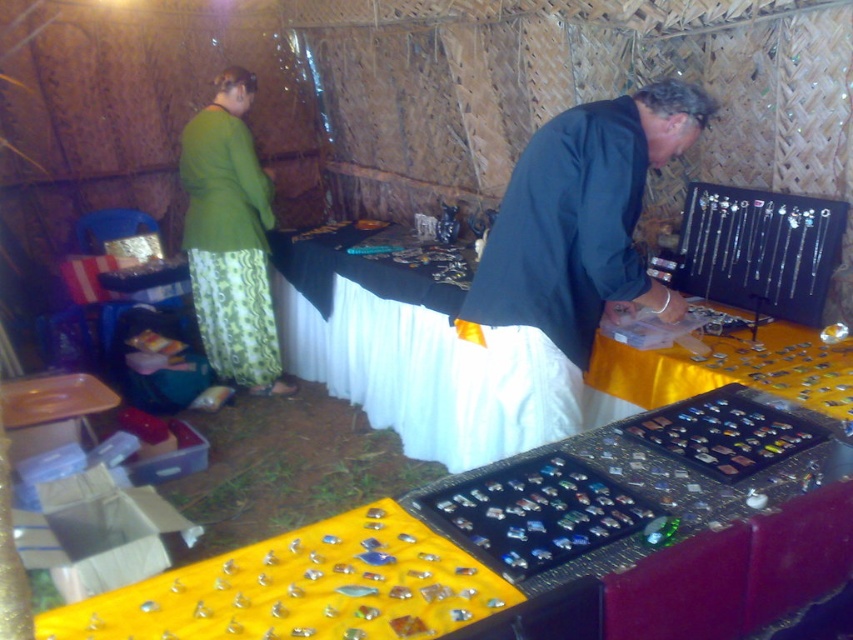
You are a customer at the market and want to place a large box on the table with the wider fabric. Which table should you choose between the yellow fabric at center and the green fabric skirt at left?

The yellow fabric at center is wider than the green fabric skirt at left, so you should choose the table with the yellow fabric at center to place the large box.

You are a customer at the market and want to pick up both the dark green fabric at center and the green fabric skirt at left. Which item should you reach for first to avoid obstructing your view of the other?

You should reach for the dark green fabric at center first since it is closer to you, allowing you to pick it up without blocking your view of the green fabric skirt at left, which is further away.